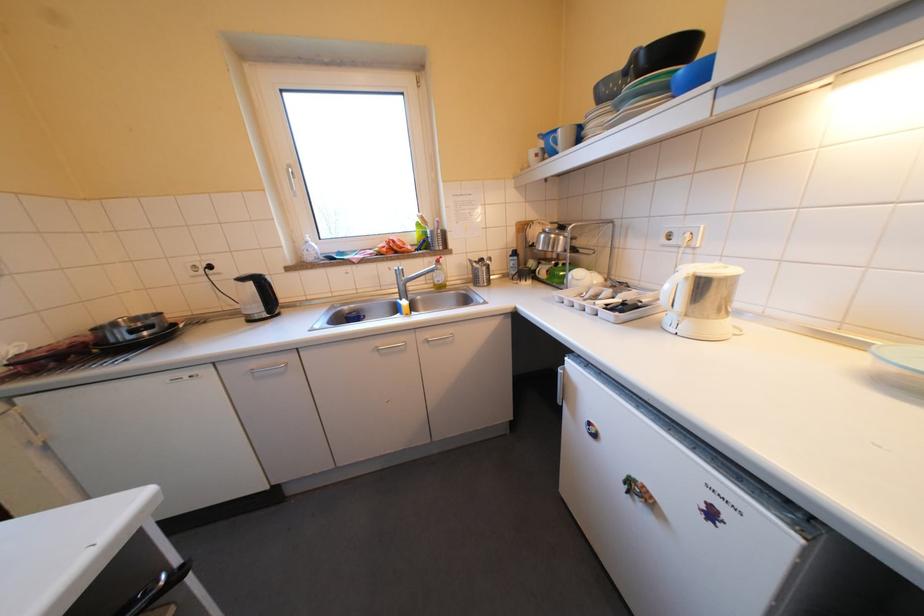
You are a GUI agent. You are given a task and a screenshot of the screen. Output one action in this format:
    pyautogui.click(x=<x>, y=<y>)
    Task: Click on the refrigerator door handle
    Image resolution: width=924 pixels, height=616 pixels.
    Given the screenshot: What is the action you would take?
    pyautogui.click(x=560, y=383)